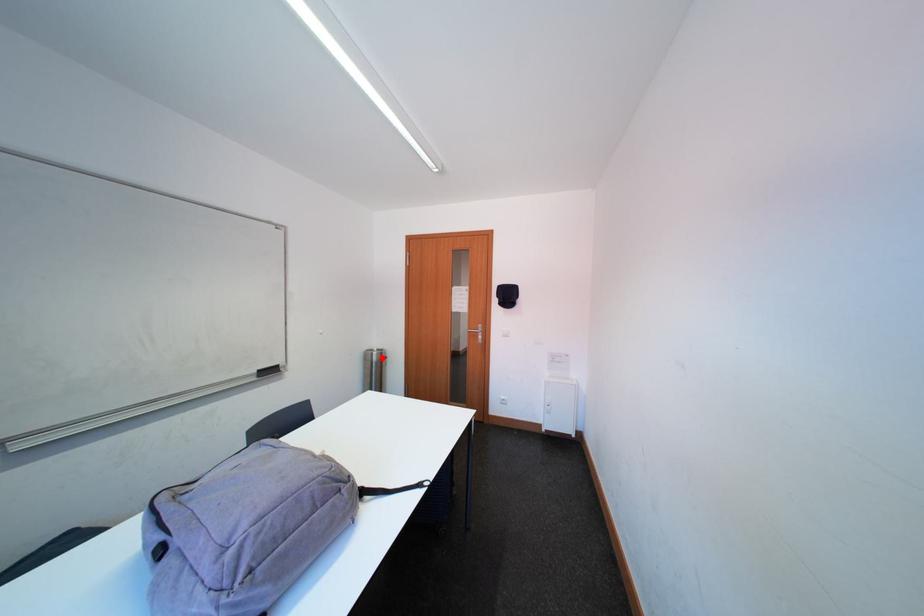
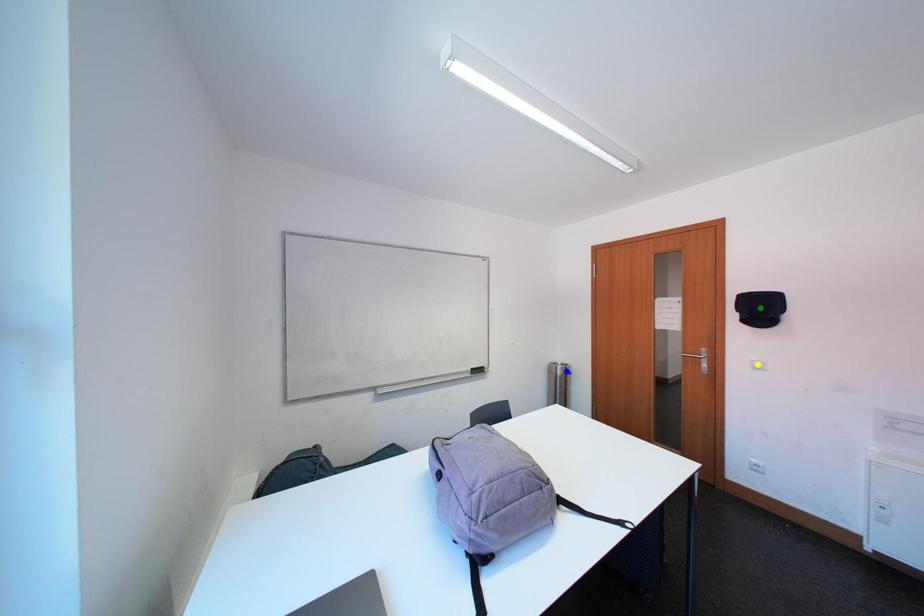
Question: I am providing you with two images of the same scene from different viewpoints. A red point is marked on the first image. You are given multiple points on the second image. Can you choose the point in image 2 that corresponds to the point in image 1?

Choices:
 (A) green point
 (B) yellow point
 (C) blue point

Answer: (C)